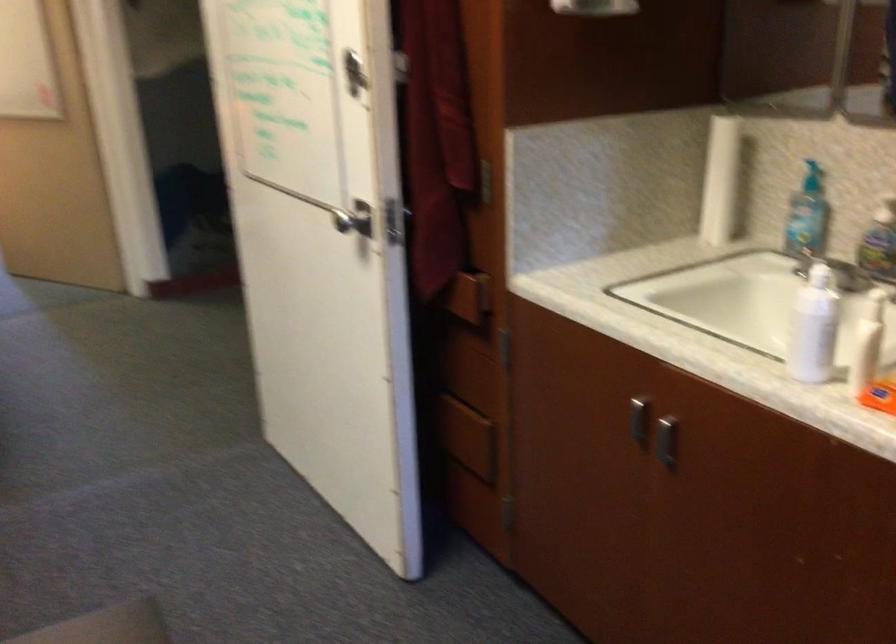
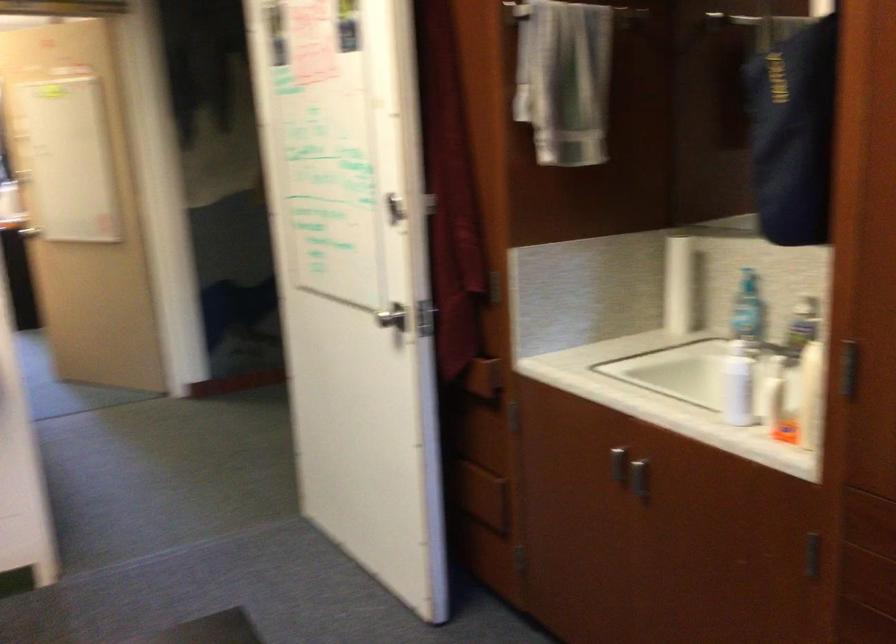
Question: I am providing you with two images of the same scene from different viewpoints. Please identify which objects are invisible in image2.

Choices:
 (A) white plastic bottle
 (B) silver cabinet handle
 (C) recessed drawer pull
 (D) none of these

Answer: (D)